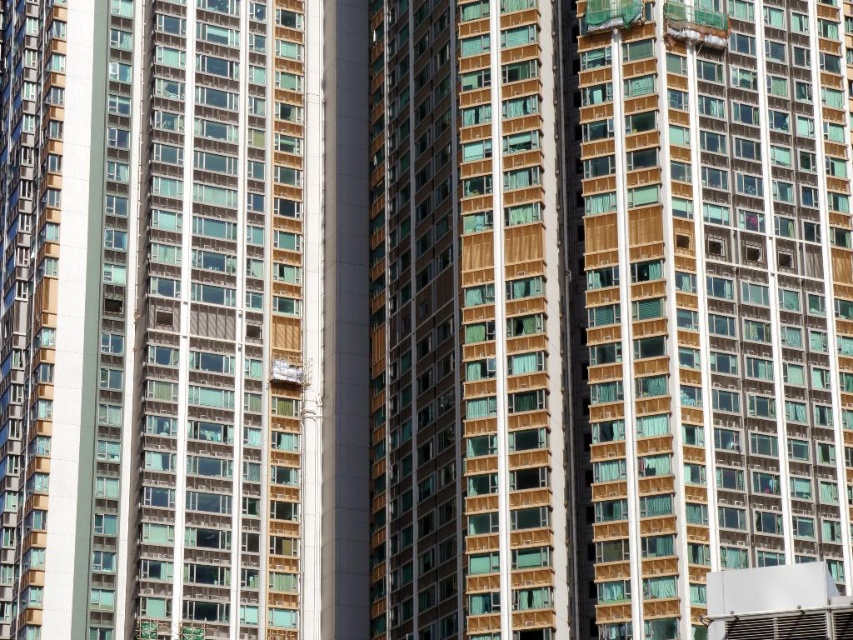
Question: Can you confirm if matte gold building at center is positioned to the left of matte brown building at center?

Choices:
 (A) yes
 (B) no

Answer: (B)

Question: Among these objects, which one is nearest to the camera?

Choices:
 (A) matte brown building at center
 (B) matte gold building at center

Answer: (B)

Question: Is matte gold building at center above matte brown building at center?

Choices:
 (A) no
 (B) yes

Answer: (A)

Question: Among these objects, which one is nearest to the camera?

Choices:
 (A) matte brown building at center
 (B) matte gold building at center

Answer: (B)

Question: In this image, where is matte gold building at center located relative to matte brown building at center?

Choices:
 (A) right
 (B) left

Answer: (A)

Question: Which object appears closest to the camera in this image?

Choices:
 (A) matte brown building at center
 (B) matte gold building at center

Answer: (B)